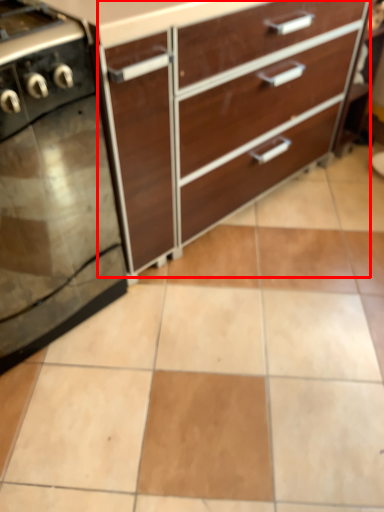
Question: From the image, what is the correct spatial relationship of chest of drawers (annotated by the red box) in relation to home appliance?

Choices:
 (A) right
 (B) left

Answer: (A)